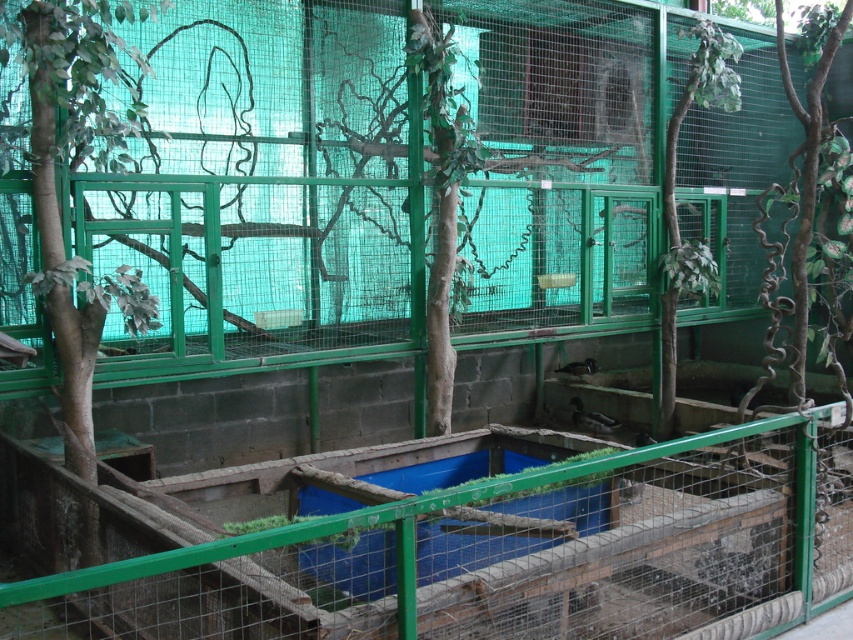
Question: Is green wire mesh at lower center wider than brown matte bird at lower center?

Choices:
 (A) yes
 (B) no

Answer: (A)

Question: Which point appears closest to the camera in this image?

Choices:
 (A) (541, 636)
 (B) (583, 412)

Answer: (A)

Question: Is green wire mesh at lower center to the right of brown matte bird at lower center from the viewer's perspective?

Choices:
 (A) yes
 (B) no

Answer: (B)

Question: Where is green wire mesh at lower center located in relation to brown matte bird at lower center in the image?

Choices:
 (A) above
 (B) below

Answer: (B)